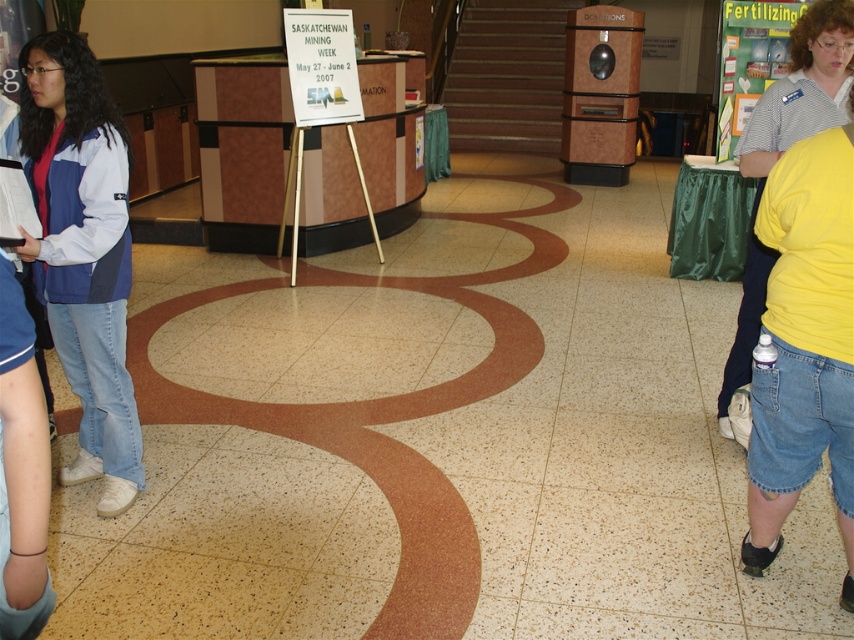
Question: Which point is farther from the camera taking this photo?

Choices:
 (A) (617, 134)
 (B) (22, 54)
 (C) (738, 356)

Answer: (A)

Question: Can you confirm if matte blue jacket at left is positioned below wooden donation box at center?

Choices:
 (A) no
 (B) yes

Answer: (B)

Question: Is matte blue jacket at left wider than yellow cotton shirt at right?

Choices:
 (A) no
 (B) yes

Answer: (B)

Question: Which point is farther to the camera?

Choices:
 (A) (572, 33)
 (B) (94, 476)
 (C) (768, 129)

Answer: (A)

Question: Which of the following is the closest to the observer?

Choices:
 (A) matte blue jacket at left
 (B) wooden donation box at center
 (C) yellow cotton shirt at right

Answer: (A)

Question: Considering the relative positions of yellow cotton shirt at right and wooden donation box at center in the image provided, where is yellow cotton shirt at right located with respect to wooden donation box at center?

Choices:
 (A) below
 (B) above

Answer: (A)